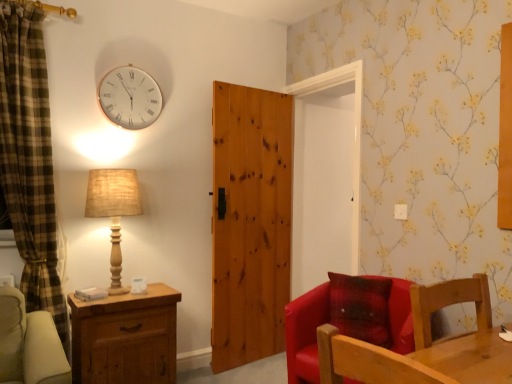
Question: Is there a large distance between wooden chair at lower right, which is counted as the second chair, starting from the back, and brown wooden chest of drawers at lower left?

Choices:
 (A) no
 (B) yes

Answer: (B)

Question: Could you tell me if wooden chair at lower right, which is counted as the second chair, starting from the back, is facing brown wooden chest of drawers at lower left?

Choices:
 (A) no
 (B) yes

Answer: (A)

Question: Does wooden chair at lower right, which is counted as the second chair, starting from the back, have a smaller size compared to brown wooden chest of drawers at lower left?

Choices:
 (A) yes
 (B) no

Answer: (A)

Question: Does wooden chair at lower right, arranged as the first chair when viewed from the front, appear on the left side of brown wooden chest of drawers at lower left?

Choices:
 (A) yes
 (B) no

Answer: (B)

Question: Is wooden chair at lower right, arranged as the first chair when viewed from the front, shorter than brown wooden chest of drawers at lower left?

Choices:
 (A) no
 (B) yes

Answer: (B)

Question: Relative to natural wood door at center, is brown wooden chest of drawers at lower left in front or behind?

Choices:
 (A) front
 (B) behind

Answer: (A)

Question: From a real-world perspective, relative to natural wood door at center, is brown wooden chest of drawers at lower left vertically above or below?

Choices:
 (A) above
 (B) below

Answer: (B)

Question: In terms of size, does brown wooden chest of drawers at lower left appear bigger or smaller than natural wood door at center?

Choices:
 (A) small
 (B) big

Answer: (A)

Question: Considering the relative positions of brown wooden chest of drawers at lower left and natural wood door at center in the image provided, is brown wooden chest of drawers at lower left to the left or to the right of natural wood door at center?

Choices:
 (A) left
 (B) right

Answer: (A)

Question: From a real-world perspective, is white glass clock at upper left above or below burlap lampshade at left?

Choices:
 (A) below
 (B) above

Answer: (B)

Question: In terms of width, does white glass clock at upper left look wider or thinner when compared to burlap lampshade at left?

Choices:
 (A) thin
 (B) wide

Answer: (A)

Question: Considering the positions of white glass clock at upper left and burlap lampshade at left in the image, is white glass clock at upper left bigger or smaller than burlap lampshade at left?

Choices:
 (A) small
 (B) big

Answer: (A)

Question: From the image's perspective, is white glass clock at upper left above or below burlap lampshade at left?

Choices:
 (A) below
 (B) above

Answer: (B)

Question: Is burlap lampshade at left situated inside wooden chair at lower right, arranged as the first chair when viewed from the front, or outside?

Choices:
 (A) outside
 (B) inside

Answer: (A)

Question: Considering their positions, is burlap lampshade at left located in front of or behind wooden chair at lower right, arranged as the first chair when viewed from the front?

Choices:
 (A) behind
 (B) front

Answer: (A)